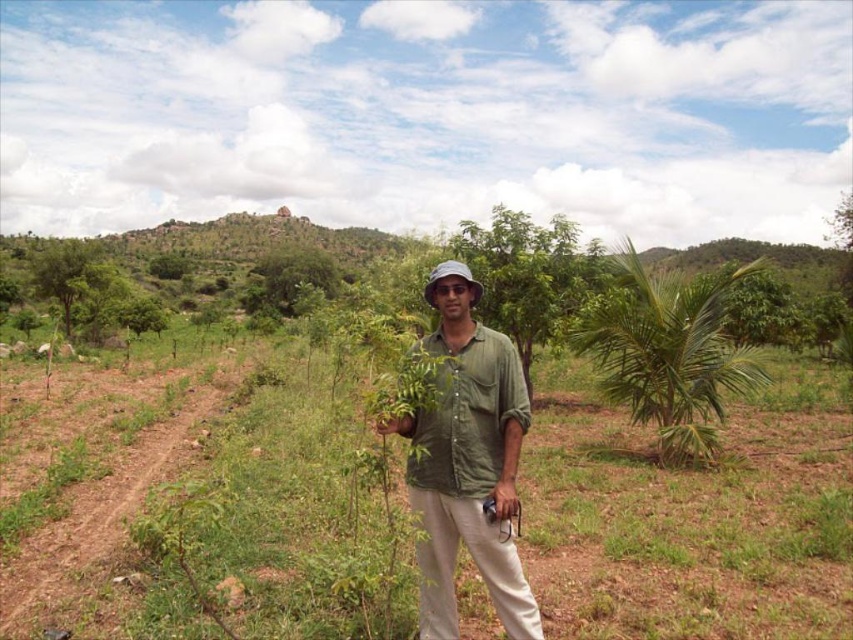
Question: Which object is positioned closest to the green leafy tree at center?

Choices:
 (A) brown soil at center
 (B) green matte shirt at center

Answer: (A)

Question: Does brown soil at center appear over green leafy tree at center?

Choices:
 (A) yes
 (B) no

Answer: (B)

Question: Can you confirm if brown soil at center is positioned to the left of green matte shirt at center?

Choices:
 (A) no
 (B) yes

Answer: (B)

Question: Which point is closer to the camera?

Choices:
 (A) (486, 531)
 (B) (688, 285)
 (C) (288, 250)
 (D) (386, 557)

Answer: (D)

Question: Can you confirm if brown soil at center is bigger than green matte shirt at center?

Choices:
 (A) no
 (B) yes

Answer: (B)

Question: Which of the following is the closest to the observer?

Choices:
 (A) (451, 548)
 (B) (292, 284)

Answer: (A)